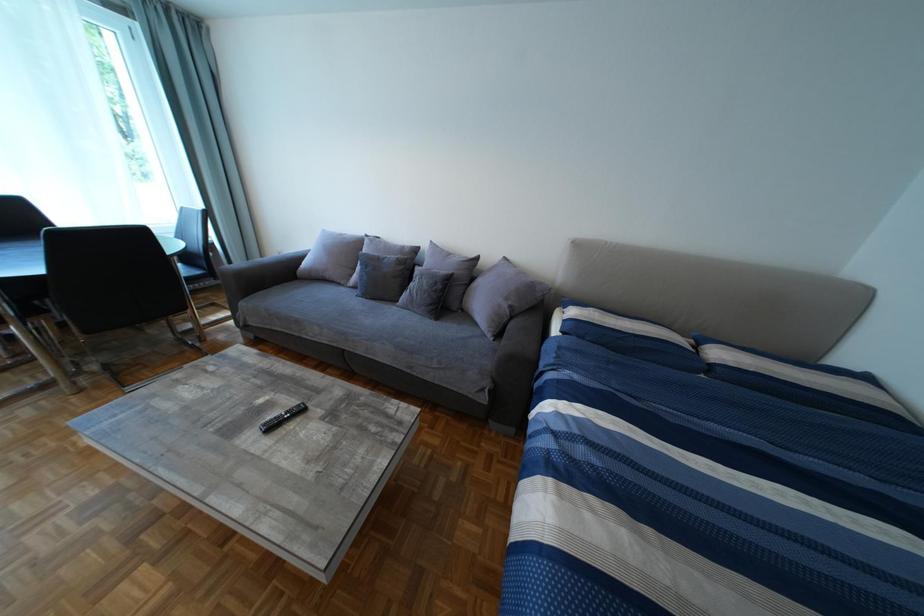
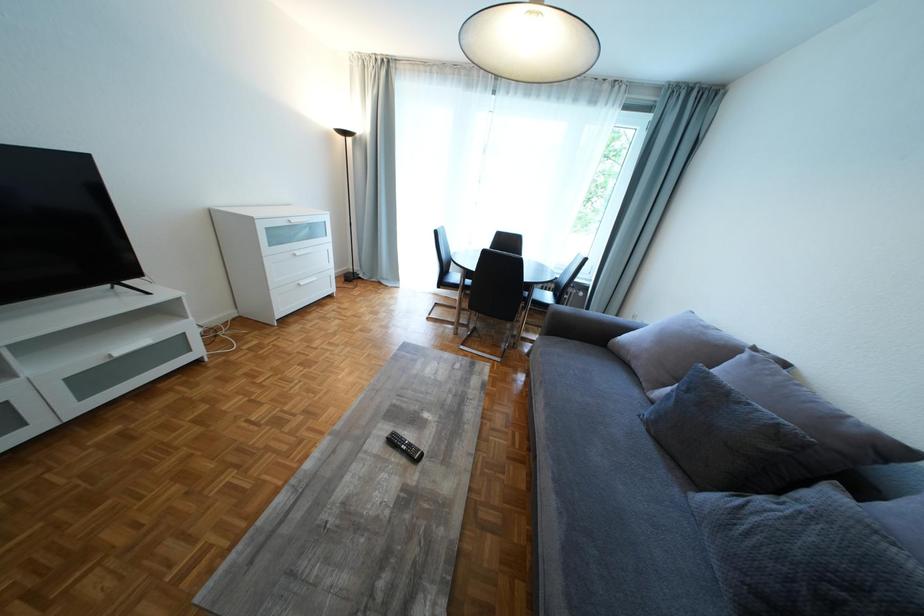
Question: The first image is from the beginning of the video and the second image is from the end. How did the camera likely rotate when shooting the video?

Choices:
 (A) Left
 (B) Right
 (C) Up
 (D) Down

Answer: (A)